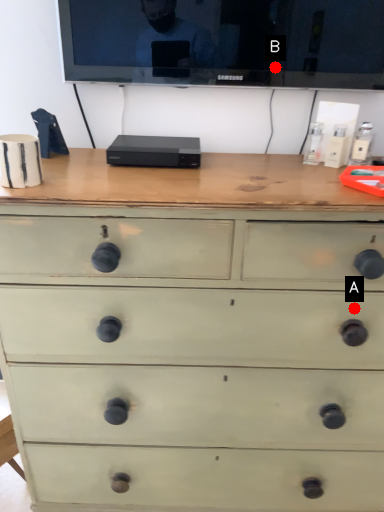
Question: Two points are circled on the image, labeled by A and B beside each circle. Which of the following is the closest to the observer?

Choices:
 (A) A is closer
 (B) B is closer

Answer: (A)